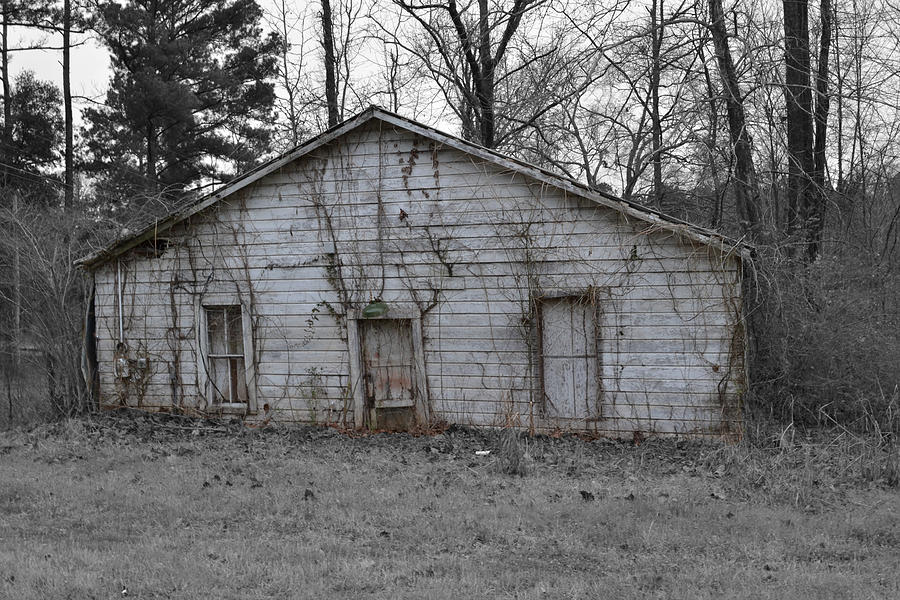
Locate an element on the screen. This screenshot has width=900, height=600. boarded up door is located at coordinates (x=392, y=386), (x=379, y=386), (x=382, y=352).